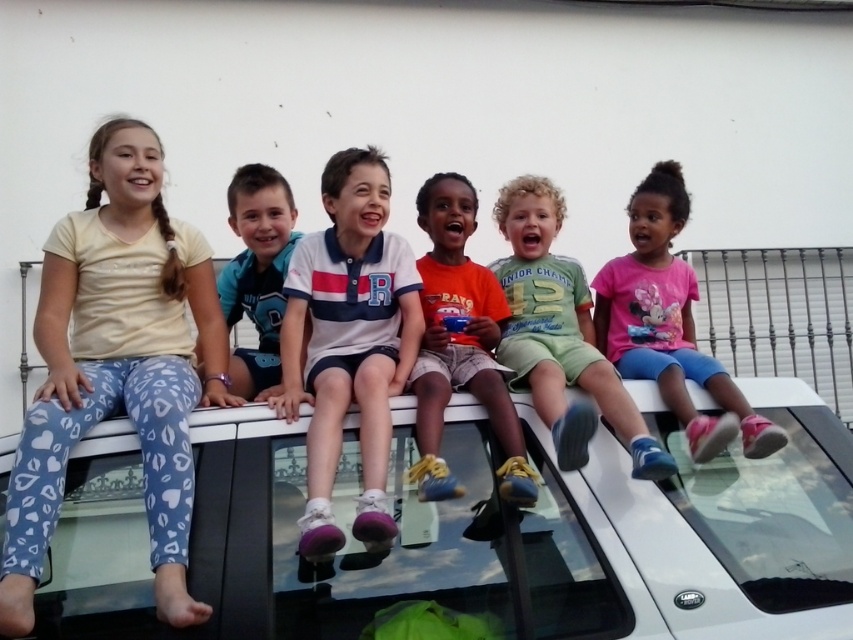
Is the position of white glossy car at center less distant than that of light blue leggings at left?

No, it is behind light blue leggings at left.

Is white glossy car at center bigger than light blue leggings at left?

No.

Measure the distance between point (347,458) and camera.

The distance of point (347,458) from camera is 2.35 meters.

At what (x,y) coordinates should I click in order to perform the action: click on white glossy car at center. Please return your answer as a coordinate pair (x, y). Image resolution: width=853 pixels, height=640 pixels. Looking at the image, I should click on (473, 532).

Is white cotton shirt at center thinner than orange cotton shirt at center?

No, white cotton shirt at center is not thinner than orange cotton shirt at center.

Can you confirm if white cotton shirt at center is shorter than orange cotton shirt at center?

In fact, white cotton shirt at center may be taller than orange cotton shirt at center.

Is point (302, 285) in front of point (474, 381)?

No, (302, 285) is behind (474, 381).

Locate an element on the screen. white cotton shirt at center is located at coordinates (349, 342).

Does white cotton shirt at center appear under pink cotton shirt at right?

Correct, white cotton shirt at center is located below pink cotton shirt at right.

Does white cotton shirt at center appear on the right side of pink cotton shirt at right?

In fact, white cotton shirt at center is to the left of pink cotton shirt at right.

At what (x,y) coordinates should I click in order to perform the action: click on white cotton shirt at center. Please return your answer as a coordinate pair (x, y). Looking at the image, I should click on (349, 342).